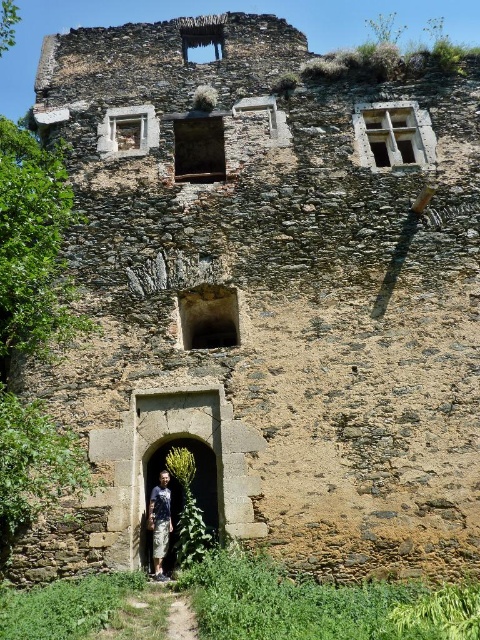
Question: Among these objects, which one is nearest to the camera?

Choices:
 (A) camouflage pants at center
 (B) dirt/gravel path at center

Answer: (B)

Question: Which of the following is the farthest from the observer?

Choices:
 (A) (179, 598)
 (B) (156, 541)

Answer: (B)

Question: Can you confirm if camouflage pants at center is positioned to the left of dirt/gravel path at center?

Choices:
 (A) no
 (B) yes

Answer: (B)

Question: Is camouflage pants at center closer to camera compared to dirt/gravel path at center?

Choices:
 (A) yes
 (B) no

Answer: (B)

Question: Among these points, which one is nearest to the camera?

Choices:
 (A) (168, 528)
 (B) (183, 621)

Answer: (B)

Question: Can you confirm if camouflage pants at center is thinner than dirt/gravel path at center?

Choices:
 (A) no
 (B) yes

Answer: (A)